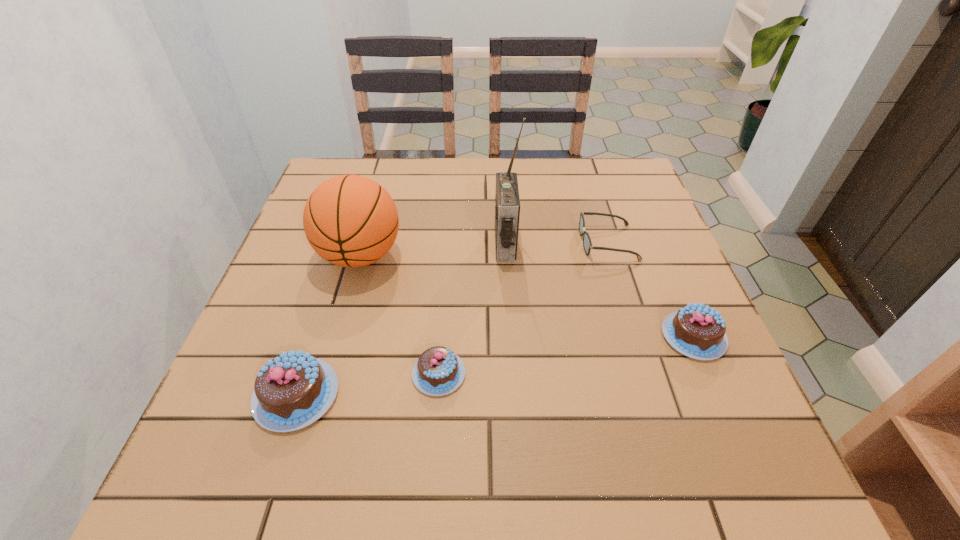
Locate an element on the screen. This screenshot has height=540, width=960. chocolate cake situated at the left edge is located at coordinates (293, 390).

I want to click on basketball present at the left edge, so (x=349, y=220).

I want to click on chocolate cake that is positioned at the right edge, so click(x=697, y=331).

Where is `spectacles that is positioned at the right edge`? spectacles that is positioned at the right edge is located at coordinates (587, 244).

I want to click on object that is at the near left corner, so click(x=293, y=390).

The image size is (960, 540). In the image, there is a desktop. Find the location of `free space at the far edge`. free space at the far edge is located at coordinates (523, 176).

At what (x,y) coordinates should I click in order to perform the action: click on vacant space at the left edge of the desktop. Please return your answer as a coordinate pair (x, y). Looking at the image, I should click on (301, 226).

In the image, there is a desktop. Where is `vacant space at the right edge`? This screenshot has width=960, height=540. vacant space at the right edge is located at coordinates (621, 272).

Identify the location of vacant space at the far left corner of the desktop. This screenshot has width=960, height=540. (329, 167).

Find the location of `vacant space in between the tallest object and the shortest chocolate cake`. vacant space in between the tallest object and the shortest chocolate cake is located at coordinates (472, 309).